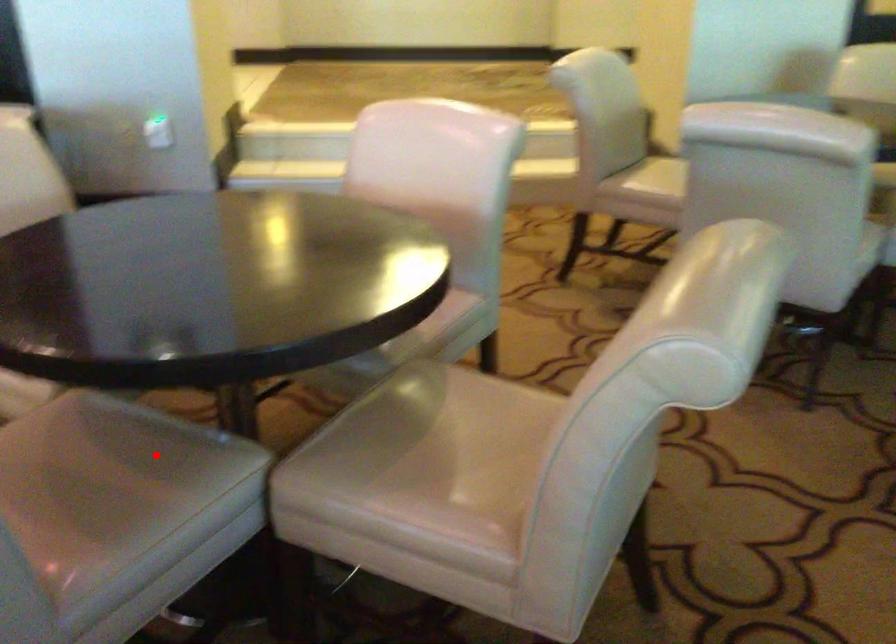
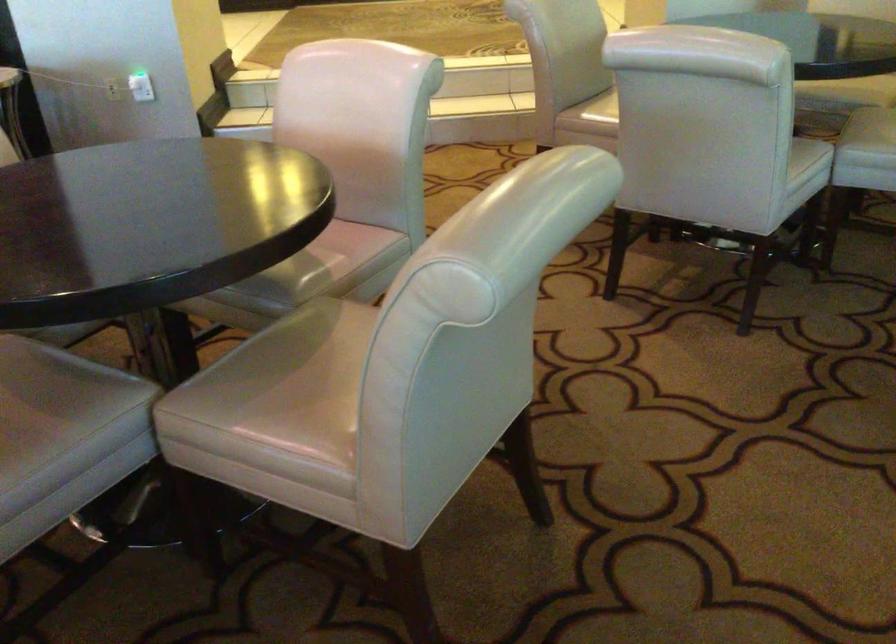
Locate, in the second image, the point that corresponds to the highlighted location in the first image.

(56, 389)